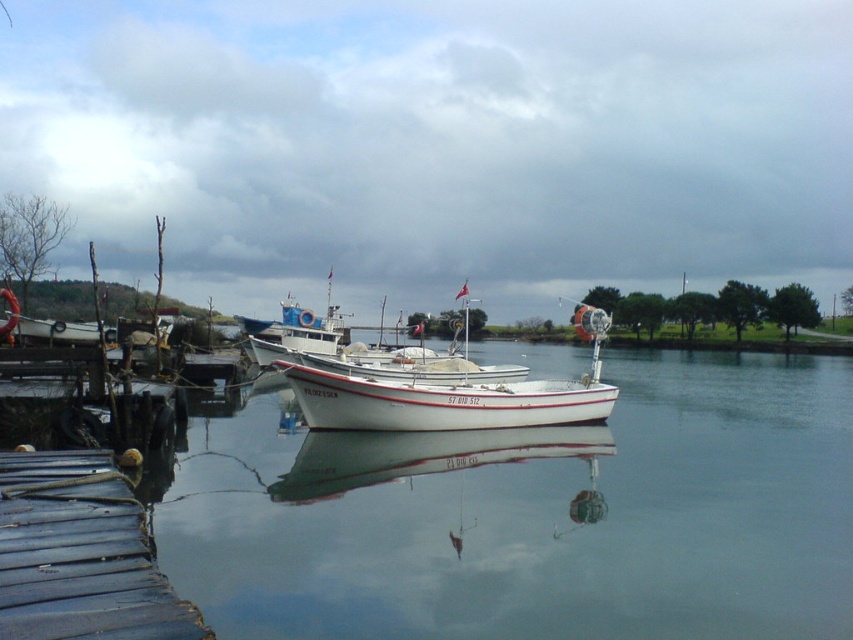
Question: Can you confirm if dark blue wooden dock at lower left is wider than white matte boat at center?

Choices:
 (A) yes
 (B) no

Answer: (A)

Question: Is the position of dark blue wooden dock at lower left more distant than that of white matte boat at center?

Choices:
 (A) yes
 (B) no

Answer: (B)

Question: Which point is closer to the camera?

Choices:
 (A) white matte boat at center
 (B) dark blue wooden dock at lower left

Answer: (B)

Question: Which point is farther to the camera?

Choices:
 (A) (605, 321)
 (B) (79, 573)

Answer: (A)

Question: Can you confirm if dark blue wooden dock at lower left is bigger than white matte boat at center?

Choices:
 (A) yes
 (B) no

Answer: (A)

Question: Among these objects, which one is farthest from the camera?

Choices:
 (A) dark blue wooden dock at lower left
 (B) white matte boat at center

Answer: (B)